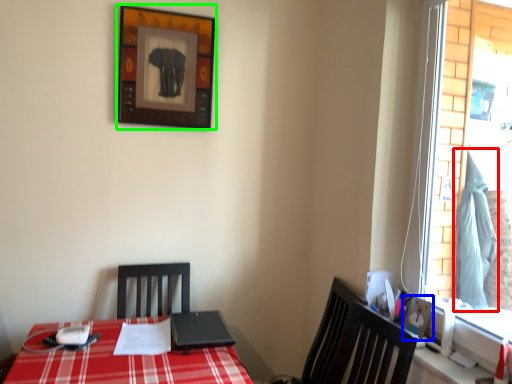
Question: Which is nearer to the curtain (highlighted by a red box)? picture frame (highlighted by a blue box) or picture frame (highlighted by a green box).

Choices:
 (A) picture frame
 (B) picture frame

Answer: (A)